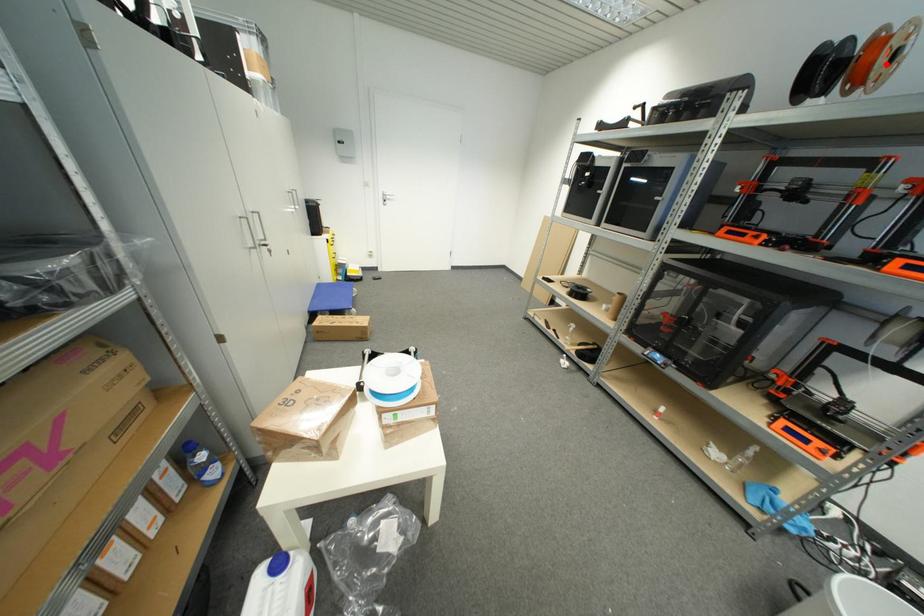
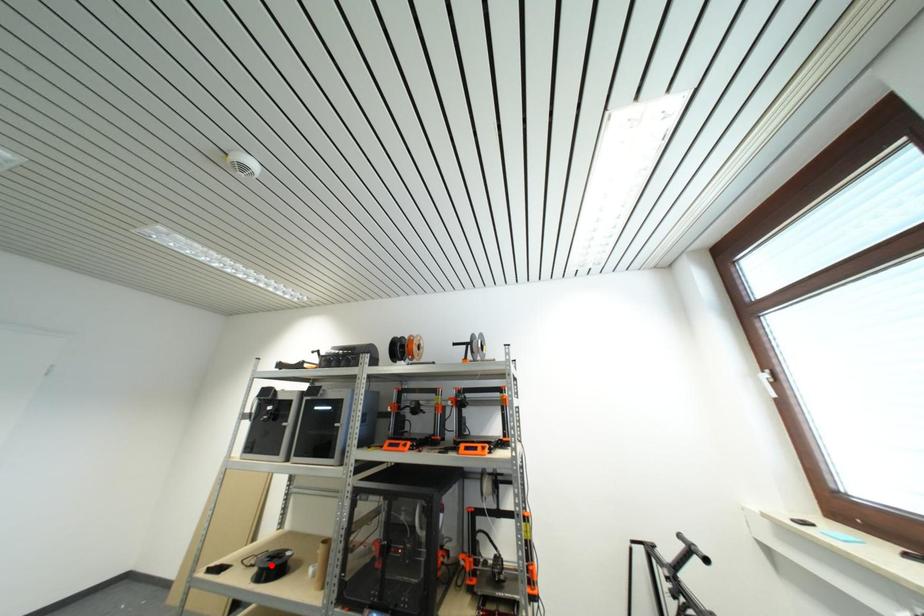
I am providing you with two images of the same scene from different viewpoints. A red point is marked on the first image and another point is marked on the second image. Is the marked point in image1 the same physical position as the marked point in image2?

No